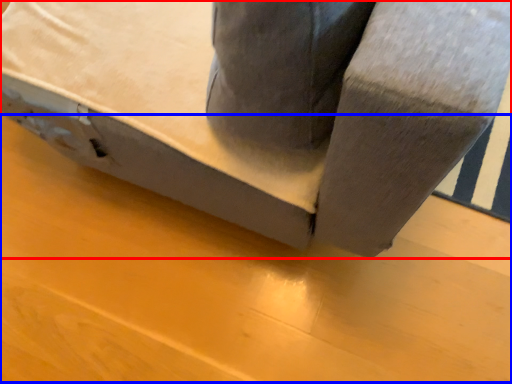
Question: Which object appears closest to the camera in this image, furniture (highlighted by a red box) or plywood (highlighted by a blue box)?

Choices:
 (A) furniture
 (B) plywood

Answer: (A)